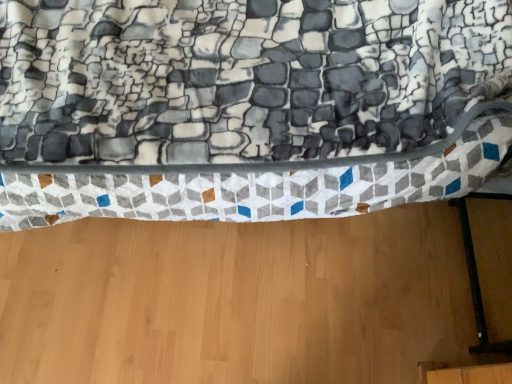
I want to click on textured fabric bed at center, so click(x=247, y=106).

The image size is (512, 384). What do you see at coordinates (247, 106) in the screenshot? I see `textured fabric bed at center` at bounding box center [247, 106].

Image resolution: width=512 pixels, height=384 pixels. Find the location of `textured fabric bed at center`. textured fabric bed at center is located at coordinates (247, 106).